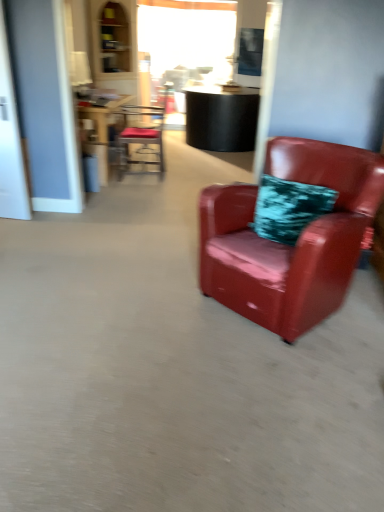
Question: From a real-world perspective, is glossy leather armchair at right, which is the second chair from top to bottom, beneath transparent glass door at left?

Choices:
 (A) yes
 (B) no

Answer: (A)

Question: Considering the relative sizes of glossy leather armchair at right, which is the second chair from top to bottom, and transparent glass door at left in the image provided, is glossy leather armchair at right, which is the second chair from top to bottom, thinner than transparent glass door at left?

Choices:
 (A) yes
 (B) no

Answer: (B)

Question: Is glossy leather armchair at right, which is the second chair from top to bottom, not near transparent glass door at left?

Choices:
 (A) yes
 (B) no

Answer: (A)

Question: Does glossy leather armchair at right, which is the 2th chair in left-to-right order, have a larger size compared to transparent glass door at left?

Choices:
 (A) yes
 (B) no

Answer: (A)

Question: Is glossy leather armchair at right, acting as the 1th chair starting from the front, closer to the viewer compared to transparent glass door at left?

Choices:
 (A) yes
 (B) no

Answer: (A)

Question: Could transparent glass door at left be considered to be inside glossy leather armchair at right, acting as the 1th chair starting from the front?

Choices:
 (A) yes
 (B) no

Answer: (B)

Question: Considering the relative sizes of transparent glass door at left and metallic red chair at upper center, which is counted as the second chair, starting from the front, in the image provided, is transparent glass door at left thinner than metallic red chair at upper center, which is counted as the second chair, starting from the front,?

Choices:
 (A) yes
 (B) no

Answer: (A)

Question: Is transparent glass door at left not within metallic red chair at upper center, which appears as the 1th chair when viewed from the left?

Choices:
 (A) yes
 (B) no

Answer: (A)

Question: Can you confirm if transparent glass door at left is taller than metallic red chair at upper center, which is counted as the second chair, starting from the front?

Choices:
 (A) no
 (B) yes

Answer: (B)

Question: Does transparent glass door at left lie behind metallic red chair at upper center, which is counted as the second chair, starting from the front?

Choices:
 (A) yes
 (B) no

Answer: (B)

Question: Considering the relative sizes of transparent glass door at left and metallic red chair at upper center, which is counted as the first chair, starting from the back, in the image provided, is transparent glass door at left wider than metallic red chair at upper center, which is counted as the first chair, starting from the back,?

Choices:
 (A) no
 (B) yes

Answer: (A)

Question: Does transparent glass door at left have a larger size compared to metallic red chair at upper center, which is counted as the first chair, starting from the back?

Choices:
 (A) yes
 (B) no

Answer: (B)

Question: Is wooden table at center positioned far away from transparent glass door at left?

Choices:
 (A) yes
 (B) no

Answer: (A)